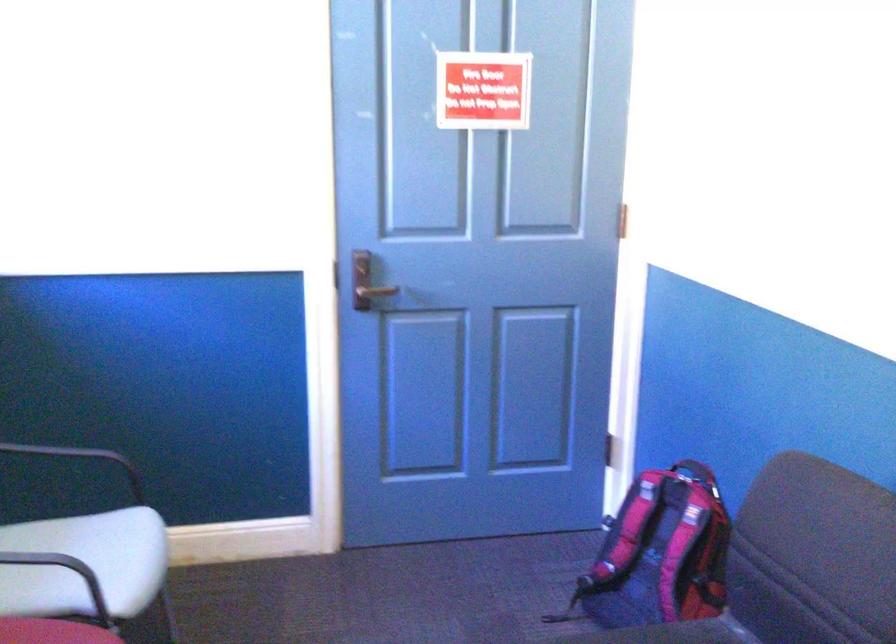
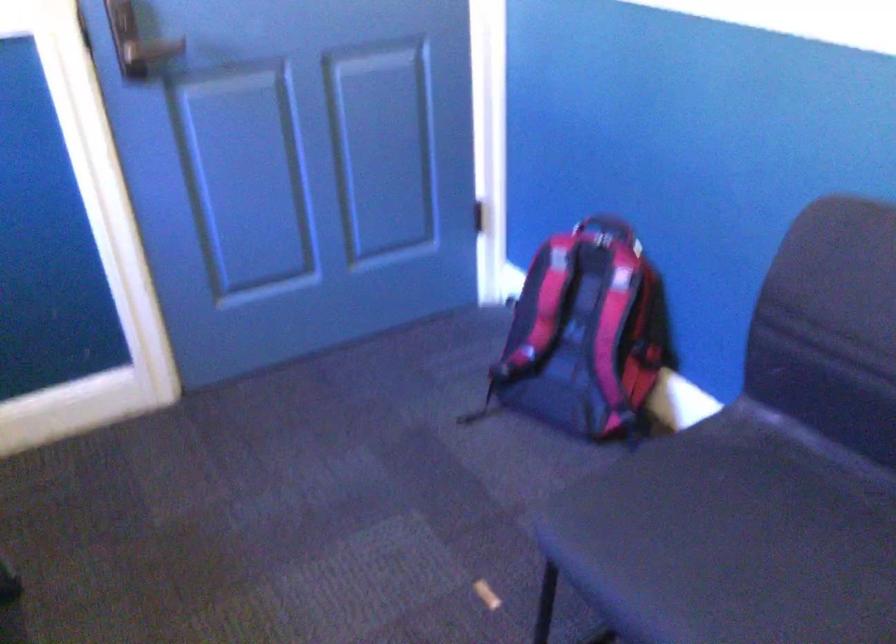
The point at (659,562) is marked in the first image. Where is the corresponding point in the second image?

(584, 335)